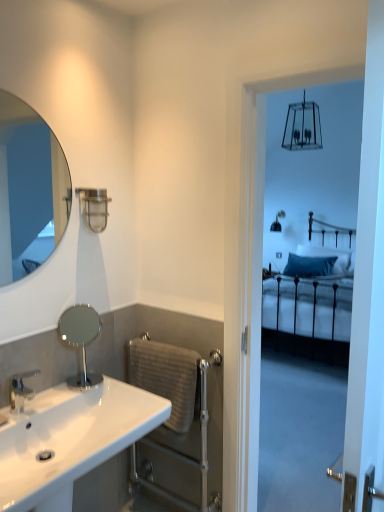
Question: Considering the positions of white glossy sink at lower left and matte silver mirror at upper left, the 2th mirror ordered from the bottom, in the image, is white glossy sink at lower left bigger or smaller than matte silver mirror at upper left, the 2th mirror ordered from the bottom,?

Choices:
 (A) big
 (B) small

Answer: (A)

Question: Visually, is white glossy sink at lower left positioned to the left or to the right of matte silver mirror at upper left, the 2th mirror ordered from the bottom?

Choices:
 (A) right
 (B) left

Answer: (A)

Question: Which object is the farthest from the polished chrome mirror at center, which ranks as the 2th mirror in top-to-bottom order?

Choices:
 (A) gray textured towel bar at lower center
 (B) silver metallic faucet at lower left
 (C) silver metallic towel rail at lower center
 (D) blue velvet pillow at center
 (E) white glossy sink at lower left

Answer: (D)

Question: Based on their relative distances, which object is nearer to the matte silver mirror at upper left, the 2th mirror ordered from the bottom?

Choices:
 (A) silver metallic faucet at lower left
 (B) satin nickel shower at upper left
 (C) gray textured towel bar at lower center
 (D) white glossy sink at lower left
 (E) silver metallic towel rail at lower center

Answer: (B)